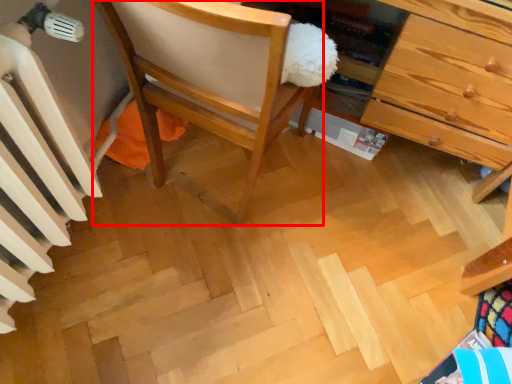
Question: From the image, what is the correct spatial relationship of chair (annotated by the red box) in relation to radiator?

Choices:
 (A) right
 (B) left

Answer: (A)